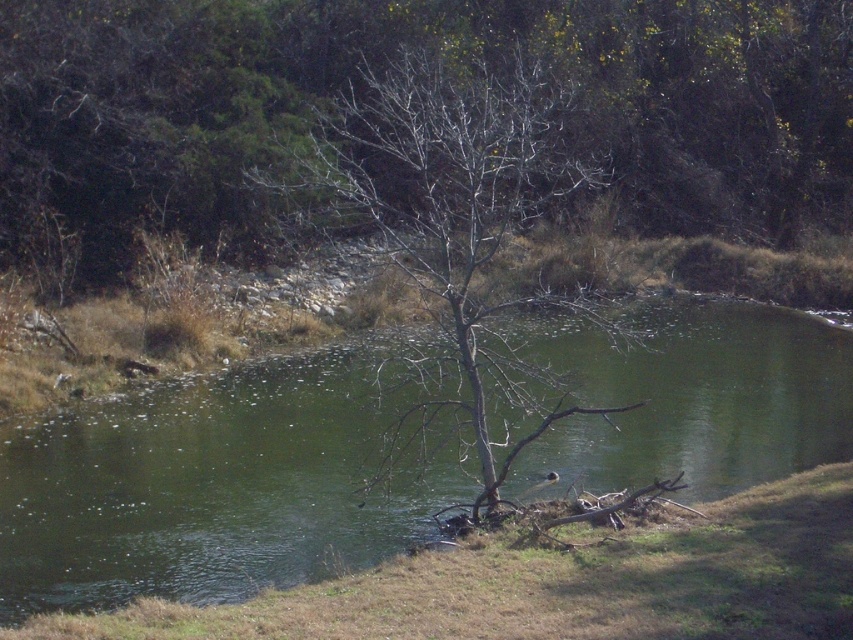
Who is more forward, (x=260, y=64) or (x=560, y=301)?

Point (x=560, y=301) is more forward.

Does bare branches at center have a greater width compared to bare wood tree at center?

Yes.

Does point (186, 17) come closer to viewer compared to point (488, 113)?

That is False.

The image size is (853, 640). I want to click on bare branches at center, so click(x=380, y=61).

Looking at this image, does green water at center have a smaller size compared to bare wood tree at center?

Indeed, green water at center has a smaller size compared to bare wood tree at center.

Can you confirm if green water at center is positioned below bare wood tree at center?

Yes.

Find the location of a particular element. Image resolution: width=853 pixels, height=640 pixels. green water at center is located at coordinates (216, 484).

What do you see at coordinates (380, 61) in the screenshot? This screenshot has height=640, width=853. I see `bare branches at center` at bounding box center [380, 61].

Can you confirm if bare branches at center is bigger than green water at center?

Correct, bare branches at center is larger in size than green water at center.

Where is `bare branches at center`? The image size is (853, 640). bare branches at center is located at coordinates (380, 61).